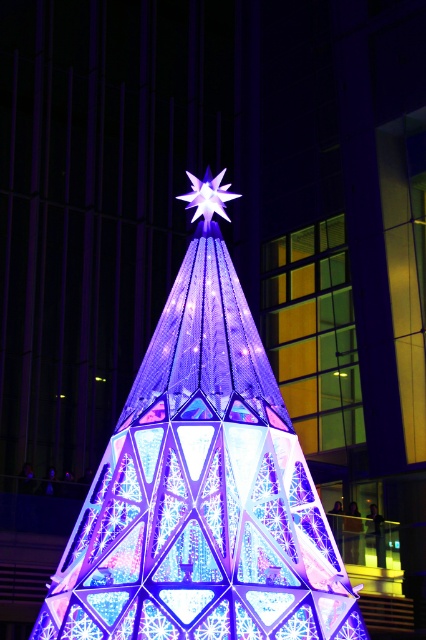
Looking at this image, who is positioned more to the right, iridescent glass christmas tree at center or iridescent glass star at center?

From the viewer's perspective, iridescent glass christmas tree at center appears more on the right side.

Which is above, iridescent glass christmas tree at center or iridescent glass star at center?

iridescent glass star at center is higher up.

Identify the location of iridescent glass christmas tree at center. This screenshot has height=640, width=426. [x=201, y=492].

At what (x,y) coordinates should I click in order to perform the action: click on iridescent glass christmas tree at center. Please return your answer as a coordinate pair (x, y). This screenshot has height=640, width=426. Looking at the image, I should click on (x=201, y=492).